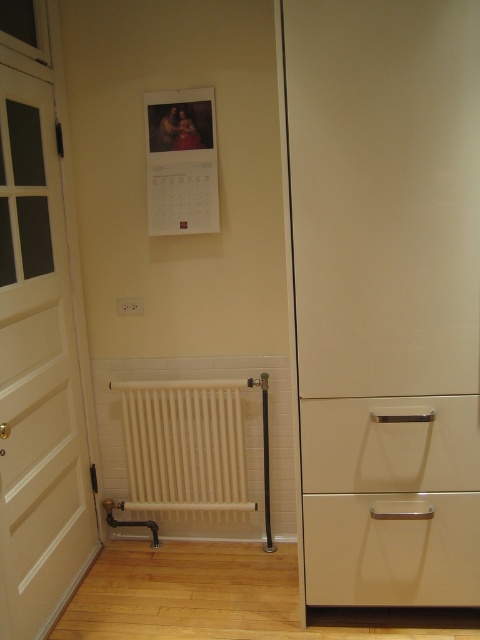
Can you confirm if white matte drawer at center right is positioned above white matte radiator at lower center?

Yes.

Does point (328, 435) lie in front of point (140, 483)?

Yes, it is in front of point (140, 483).

Is point (471, 401) farther from viewer compared to point (166, 472)?

That is False.

Identify the location of white matte drawer at center right. This screenshot has width=480, height=640. click(x=389, y=444).

Who is more distant from viewer, [479,531] or [241,483]?

Positioned behind is point [241,483].

Is point (312, 506) farther from viewer compared to point (158, 490)?

No, (312, 506) is in front of (158, 490).

Who is more forward, (355, 509) or (199, 381)?

Point (355, 509) is more forward.

This screenshot has width=480, height=640. I want to click on beige matte drawer at lower right, so click(x=392, y=548).

Does point (38, 572) lie behind point (459, 602)?

Yes.

Is white matte door at left further to camera compared to beige matte drawer at lower right?

No, it is in front of beige matte drawer at lower right.

Where is `white matte door at left`? This screenshot has width=480, height=640. white matte door at left is located at coordinates (37, 372).